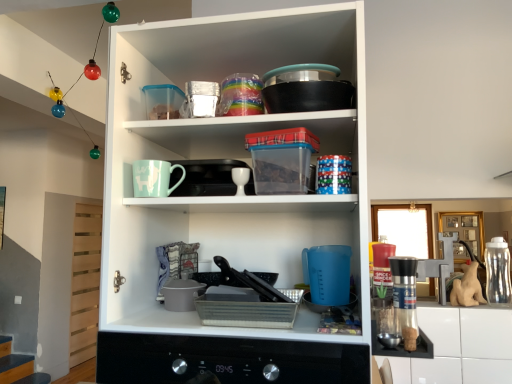
Find the location of a particular element. empty space that is ontop of matte white cupboard at center (from a real-world perspective) is located at coordinates (237, 44).